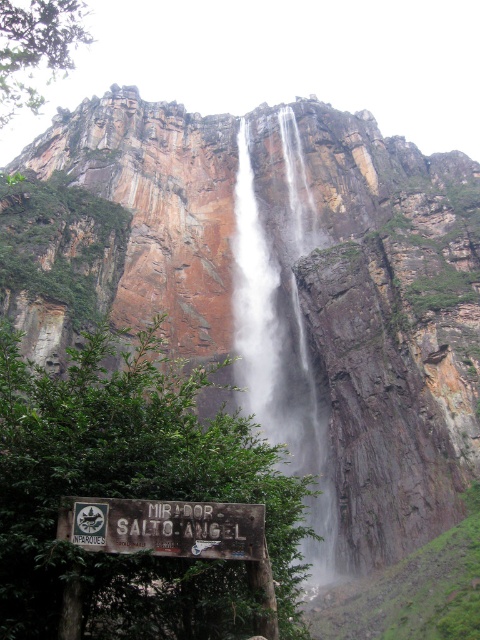
Question: Considering the relative positions of white misty waterfall at center and weathered wood sign at lower center in the image provided, where is white misty waterfall at center located with respect to weathered wood sign at lower center?

Choices:
 (A) right
 (B) left

Answer: (A)

Question: Can you confirm if white misty waterfall at center is thinner than weathered wood sign at lower center?

Choices:
 (A) no
 (B) yes

Answer: (A)

Question: Which point is farther from the camera taking this photo?

Choices:
 (A) (333, 556)
 (B) (204, 550)

Answer: (A)

Question: Is white misty waterfall at center positioned before weathered wood sign at lower center?

Choices:
 (A) no
 (B) yes

Answer: (A)